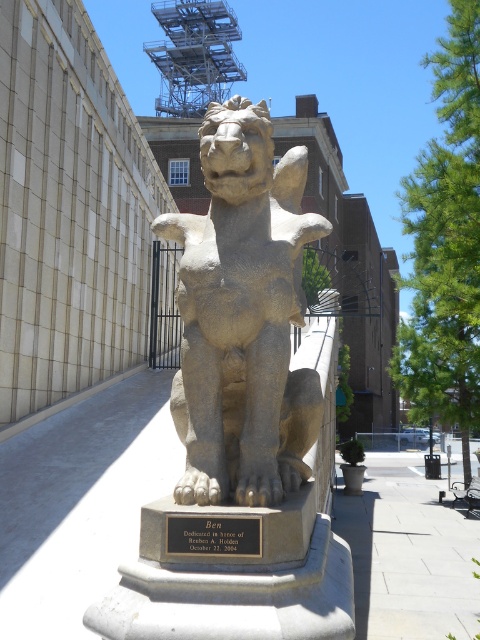
Does bronze plaque at center have a lesser height compared to brown stone paw at lower center?

Indeed, bronze plaque at center has a lesser height compared to brown stone paw at lower center.

Which is above, bronze plaque at center or brown stone paw at lower center?

Positioned higher is brown stone paw at lower center.

This screenshot has height=640, width=480. In order to click on bronze plaque at center in this screenshot , I will do `click(214, 534)`.

Does stone lion at center appear over brown stone paw at lower center?

Indeed, stone lion at center is positioned over brown stone paw at lower center.

Which is in front, point (197, 486) or point (261, 502)?

Point (261, 502)

Which is behind, point (254, 440) or point (261, 472)?

The point (254, 440) is more distant.

Find the location of a particular element. stone lion at center is located at coordinates (242, 308).

Can you confirm if stone lion at center is positioned above bronze plaque at center?

Indeed, stone lion at center is positioned over bronze plaque at center.

Can you confirm if stone lion at center is taller than bronze plaque at center?

Indeed, stone lion at center has a greater height compared to bronze plaque at center.

Where is `stone lion at center`? Image resolution: width=480 pixels, height=640 pixels. stone lion at center is located at coordinates (242, 308).

Identify the location of stone lion at center. (242, 308).